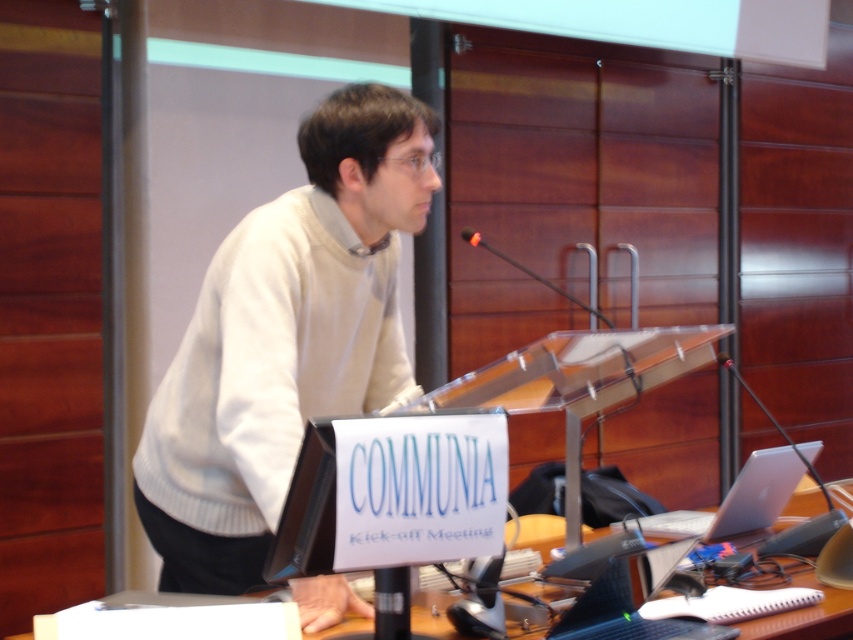
You are a photographer setting up for a presentation. You need to place a camera 5 feet away from the black glossy laptop at lower center to avoid reflections. Is the current distance sufficient?

The black glossy laptop at lower center is currently 4.87 feet away from the camera, which is just under the required 5 feet. To meet the requirement, move the camera slightly further back to ensure the distance is at least 5 feet.

You are an attendee at the COMMUNIA Kickoff Meeting. You need to take a photo of the presenter wearing the white knitted sweater at center and the silver metallic laptop at lower right. Which object should you focus on first to ensure both are in frame?

The white knitted sweater at center is much taller than the silver metallic laptop at lower right, so you should focus on the white knitted sweater at center first to ensure both are in frame.